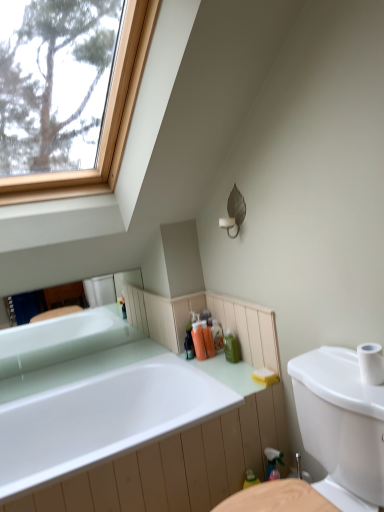
Locate an element on the screen. The image size is (384, 512). free location to the left of white matte toilet paper at right is located at coordinates (342, 380).